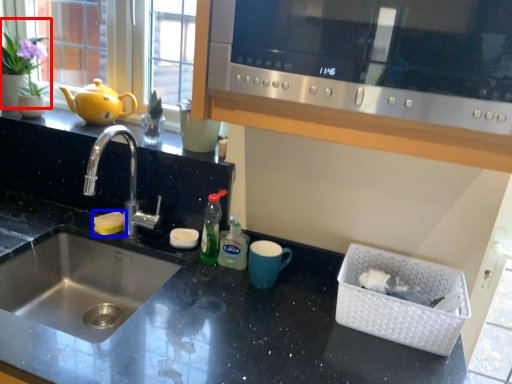
Question: Which object is further to the camera taking this photo, plant (highlighted by a red box) or food (highlighted by a blue box)?

Choices:
 (A) plant
 (B) food

Answer: (A)